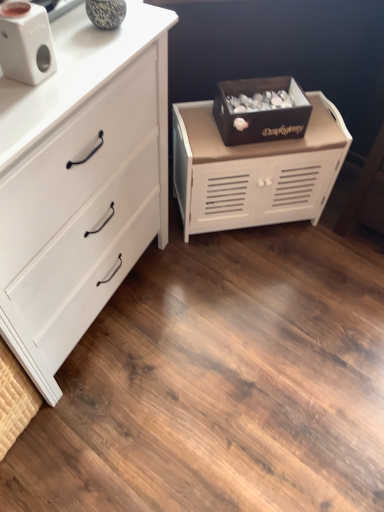
Locate an element on the screen. free space in front of white matte chest of drawers at left, the first chest of drawers from the left is located at coordinates (109, 432).